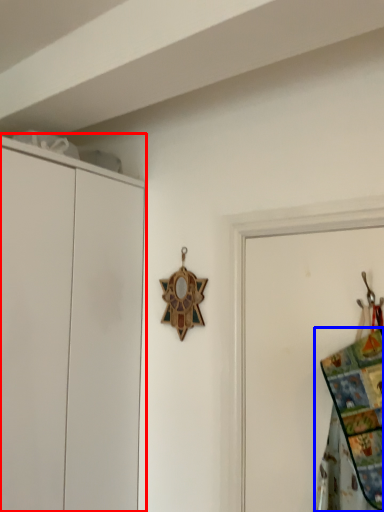
Question: Which object appears closest to the camera in this image, cupboard (highlighted by a red box) or blanket (highlighted by a blue box)?

Choices:
 (A) cupboard
 (B) blanket

Answer: (B)